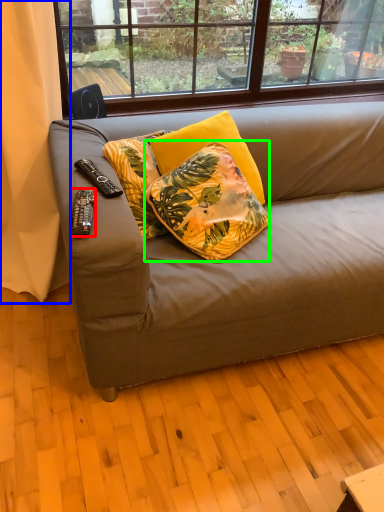
Question: Considering the real-world distances, which object is closest to remote control (highlighted by a red box)? curtain (highlighted by a blue box) or pillow (highlighted by a green box).

Choices:
 (A) curtain
 (B) pillow

Answer: (B)